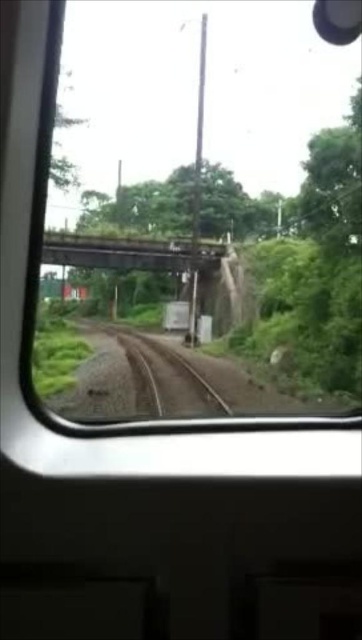
You are standing inside the train looking out the window. You see two points marked on the window. The first point is at coordinates point (83, 400) and the second point is at point (115, 252). Which point is closer to the bridge that the train is approaching?

Point (83, 400) is in front of point (115, 252), so it is closer to the bridge that the train is approaching.

You are a train conductor checking the route ahead. You notice the brown gravel train track at center and the metal bridge at center. Which one appears smaller in the image?

The brown gravel train track at center appears smaller in the image compared to the metal bridge at center because the brown gravel train track at center has a smaller size compared to metal bridge at center.

Based on the photo, you are a passenger on the train and want to know which object is nearer to you through the window. Which is closer to you, the brown gravel train track at center or the metal bridge at center?

The brown gravel train track at center is closer to the viewer than the metal bridge at center.